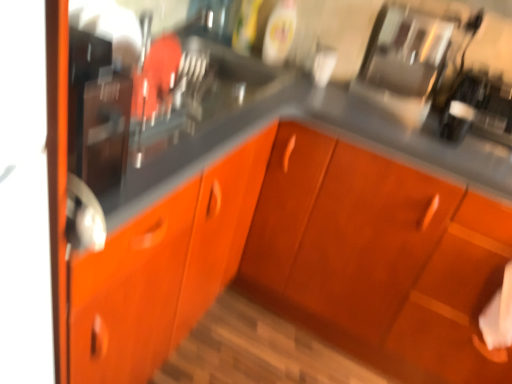
Question: Looking at the image, does glossy stainless steel coffee maker at upper right seem bigger or smaller compared to matte black sink at left?

Choices:
 (A) small
 (B) big

Answer: (B)

Question: From a real-world perspective, is glossy stainless steel coffee maker at upper right physically located above or below matte black sink at left?

Choices:
 (A) above
 (B) below

Answer: (B)

Question: Based on their relative distances, which object is nearer to the glossy stainless steel coffee maker at upper right?

Choices:
 (A) orange matte cabinet at center
 (B) matte black sink at left

Answer: (B)

Question: Estimate the real-world distances between objects in this image. Which object is farther from the glossy stainless steel coffee maker at upper right?

Choices:
 (A) orange matte cabinet at center
 (B) matte black sink at left

Answer: (A)